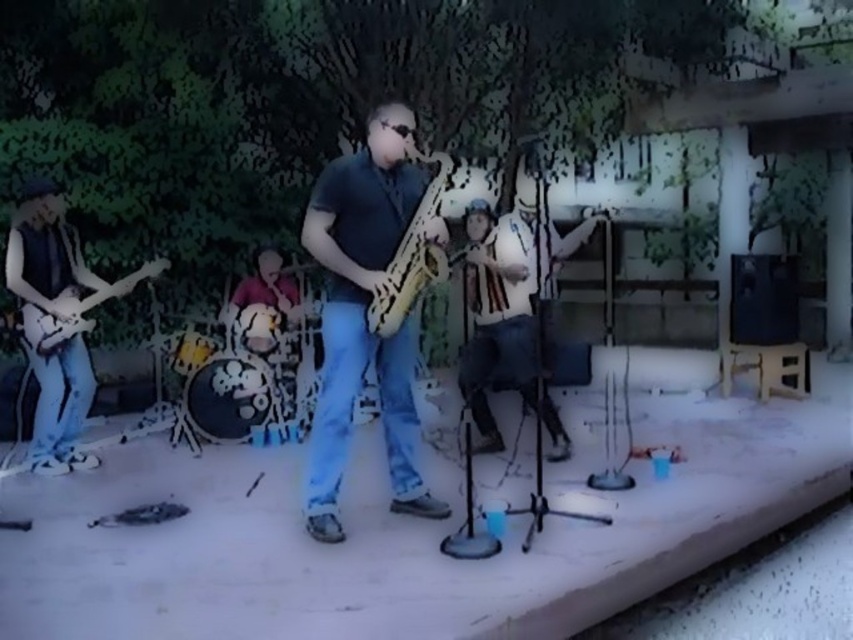
Question: Does wooden saxophone at center come behind matte black electric guitar at left?

Choices:
 (A) no
 (B) yes

Answer: (A)

Question: Considering the real-world distances, which object is closest to the matte yellow saxophone at center?

Choices:
 (A) wooden saxophone at center
 (B) matte black electric guitar at left

Answer: (A)

Question: Can you confirm if matte yellow saxophone at center is positioned below matte black electric guitar at left?

Choices:
 (A) yes
 (B) no

Answer: (A)

Question: Which object appears farthest from the camera in this image?

Choices:
 (A) matte black electric guitar at left
 (B) wooden saxophone at center

Answer: (A)

Question: Which point appears farthest from the camera in this image?

Choices:
 (A) (4, 268)
 (B) (437, 211)
 (C) (315, 472)

Answer: (A)

Question: Is wooden saxophone at center positioned in front of matte black electric guitar at left?

Choices:
 (A) yes
 (B) no

Answer: (A)